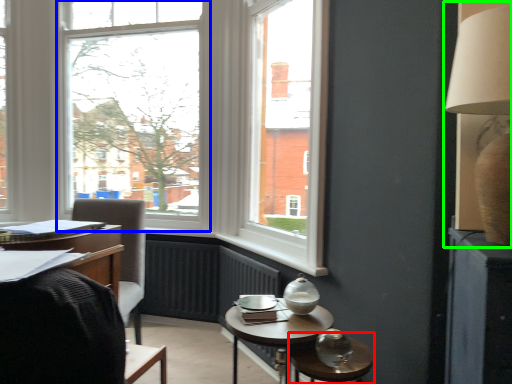
Question: Which object is positioned closest to glass table (highlighted by a red box)? Select from window (highlighted by a blue box) and table lamp (highlighted by a green box).

Choices:
 (A) window
 (B) table lamp

Answer: (B)